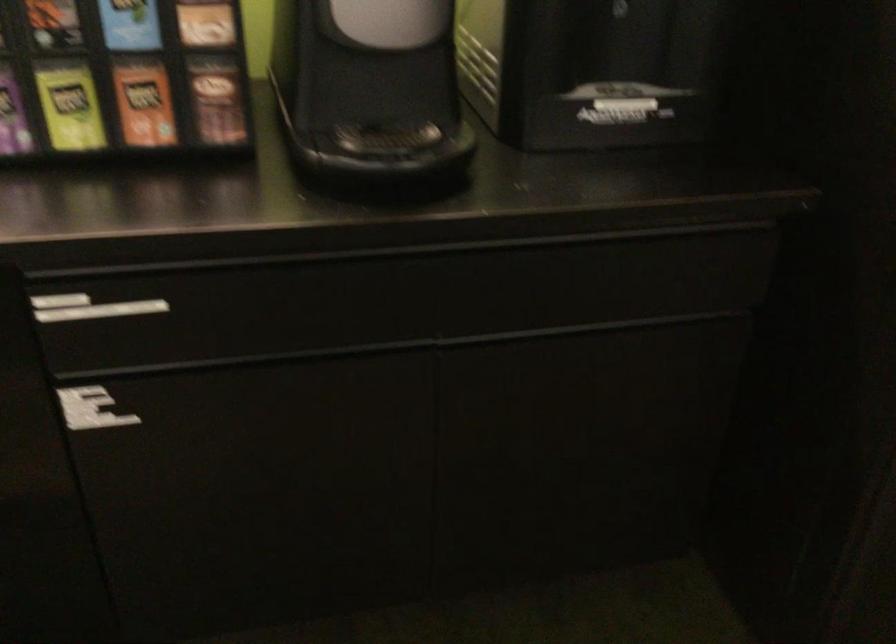
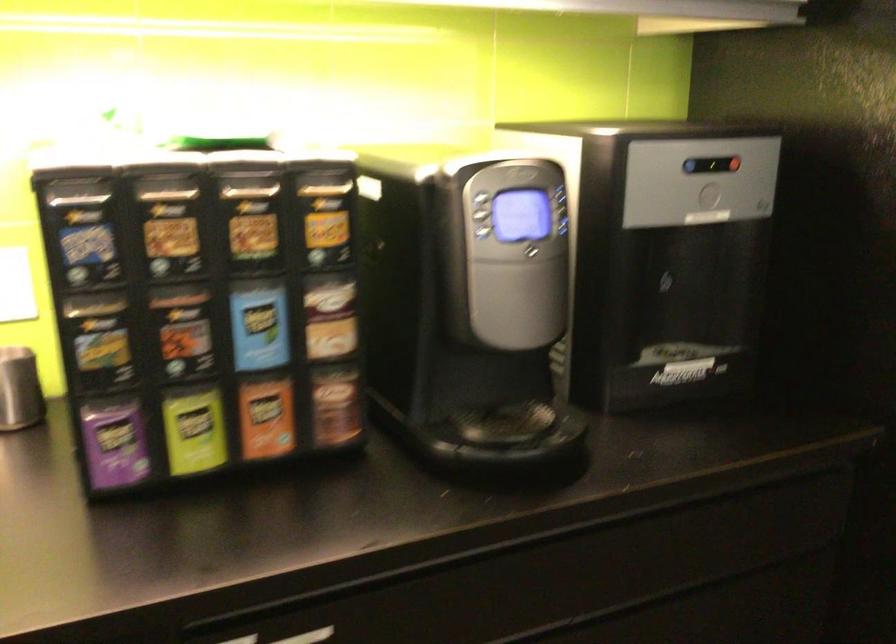
Question: How did the camera likely rotate?

Choices:
 (A) Left
 (B) Right
 (C) Up
 (D) Down

Answer: (C)